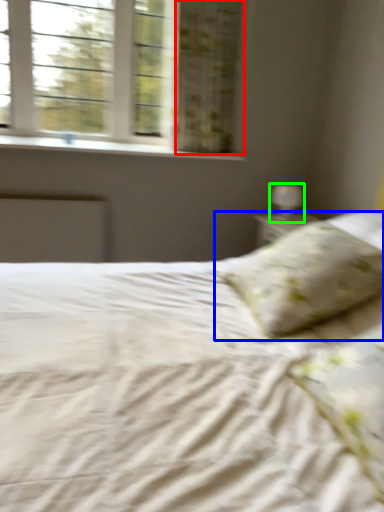
Question: Which object is the farthest from curtain (highlighted by a red box)? Choose among these: pillow (highlighted by a blue box) or table lamp (highlighted by a green box).

Choices:
 (A) pillow
 (B) table lamp

Answer: (A)